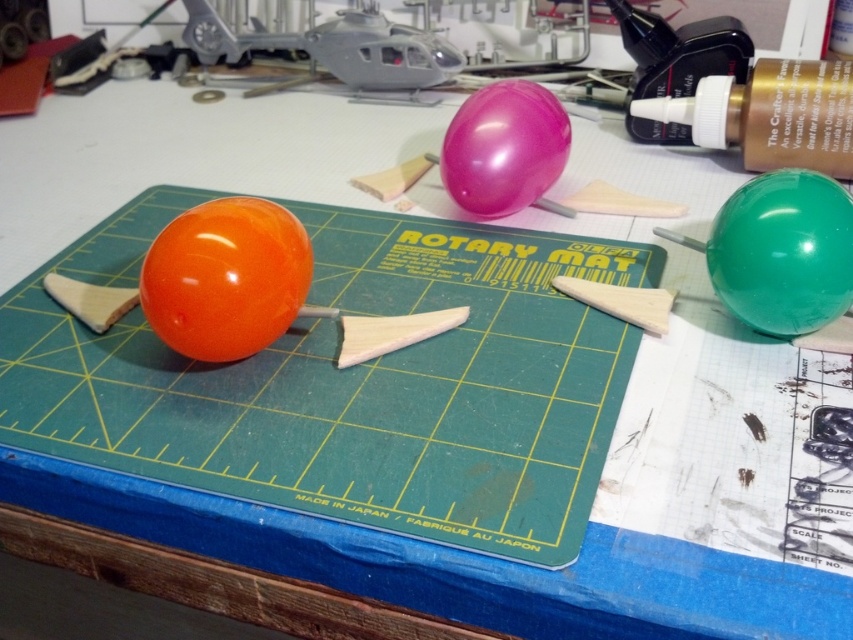
Is point (241, 314) positioned behind point (560, 138)?

No, (241, 314) is in front of (560, 138).

Is orange glossy balloon at center wider than glossy rubber balloon at center?

Correct, the width of orange glossy balloon at center exceeds that of glossy rubber balloon at center.

Locate an element on the screen. orange glossy balloon at center is located at coordinates (225, 276).

The width and height of the screenshot is (853, 640). In order to click on orange glossy balloon at center in this screenshot , I will do `click(225, 276)`.

Does orange glossy balloon at center have a lesser height compared to green glossy balloon at right?

No, orange glossy balloon at center is not shorter than green glossy balloon at right.

Does orange glossy balloon at center have a larger size compared to green glossy balloon at right?

Indeed, orange glossy balloon at center has a larger size compared to green glossy balloon at right.

Does point (248, 246) lie in front of point (827, 308)?

No.

You are a GUI agent. You are given a task and a screenshot of the screen. Output one action in this format:
    pyautogui.click(x=<x>, y=<y>)
    Task: Click on the orange glossy balloon at center
    The height and width of the screenshot is (640, 853).
    Given the screenshot: What is the action you would take?
    pyautogui.click(x=225, y=276)

Is green glossy balloon at right bigger than glossy rubber balloon at center?

No.

Between point (802, 294) and point (543, 104), which one is positioned in front?

Positioned in front is point (802, 294).

The height and width of the screenshot is (640, 853). Describe the element at coordinates (782, 252) in the screenshot. I see `green glossy balloon at right` at that location.

Find the location of `green glossy balloon at right`. green glossy balloon at right is located at coordinates (782, 252).